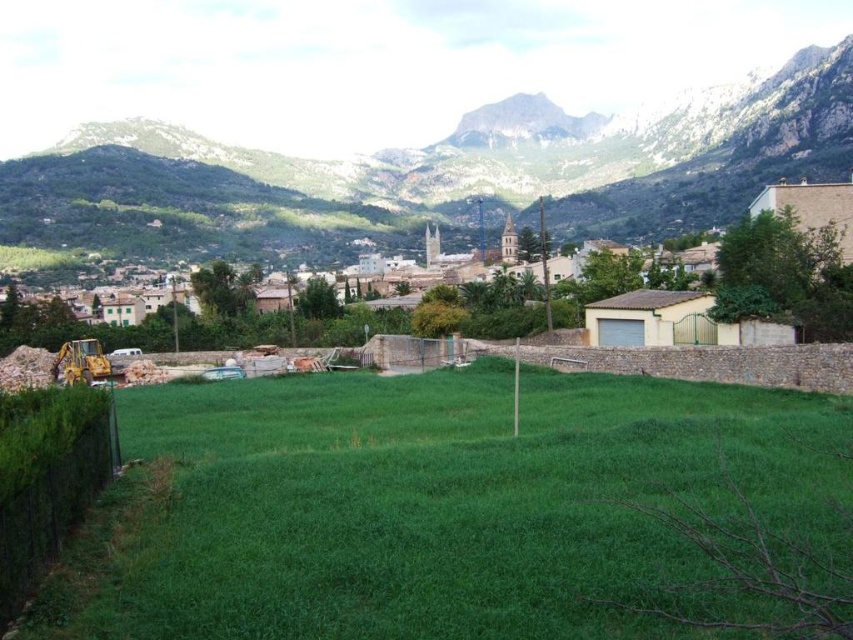
Can you confirm if green grassy field at lower left is taller than yellow metallic excavator at lower left?

Indeed, green grassy field at lower left has a greater height compared to yellow metallic excavator at lower left.

Does point (206, 502) come farther from viewer compared to point (90, 358)?

No, (206, 502) is in front of (90, 358).

Describe the element at coordinates (445, 508) in the screenshot. I see `green grassy field at lower left` at that location.

Identify the location of green grassy field at lower left. This screenshot has width=853, height=640. (445, 508).

Is rocky brown mountain at upper center closer to the viewer compared to yellow metallic excavator at lower left?

No, rocky brown mountain at upper center is behind yellow metallic excavator at lower left.

Is rocky brown mountain at upper center bigger than yellow metallic excavator at lower left?

Correct, rocky brown mountain at upper center is larger in size than yellow metallic excavator at lower left.

Is point (763, 108) in front of point (84, 362)?

No, it is not.

Where is `rocky brown mountain at upper center`? The width and height of the screenshot is (853, 640). rocky brown mountain at upper center is located at coordinates (434, 173).

Which of these two, green grassy field at lower left or rocky brown mountain at upper center, stands shorter?

Standing shorter between the two is green grassy field at lower left.

Is point (532, 401) less distant than point (285, 241)?

Yes, point (532, 401) is closer to viewer.

The image size is (853, 640). I want to click on green grassy field at lower left, so click(445, 508).